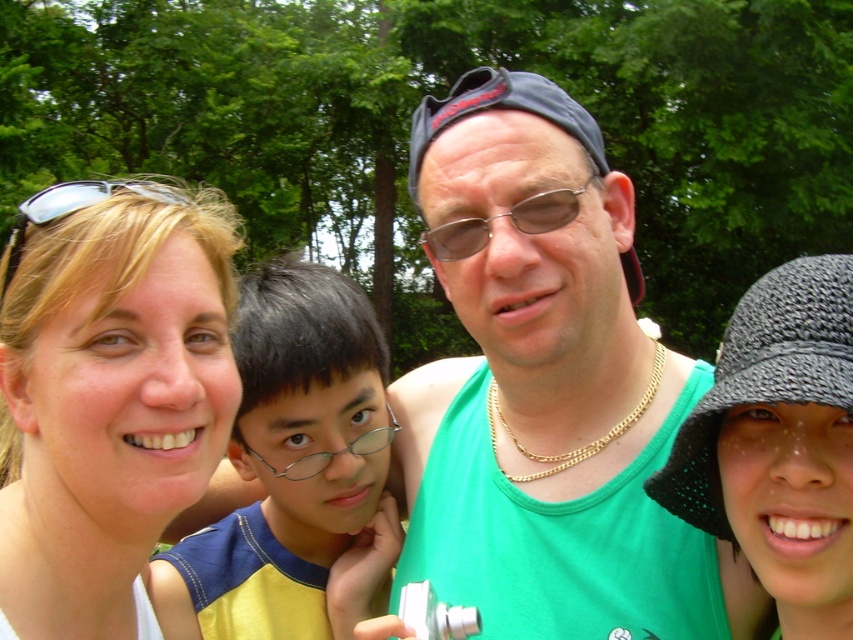
You are trying to decide which item to grab first from the scene. Based on their sizes, which one is wider between the green fabric tank top at center and the blonde hair at upper left?

The green fabric tank top at center is wider than the blonde hair at upper left according to the description.

You are a photographer trying to capture the blonde hair at upper left and the yellow fabric shirt at center in a single frame. Can you ensure both are visible in the shot without moving any subjects?

The blonde hair at upper left is positioned over the yellow fabric shirt at center, so the photographer can capture both in the frame as they are already overlapping and not obstructed from view.

You are a photographer standing 1 meter away from the green fabric tank top at center and the yellow fabric shirt at center. You want to take a group photo of both items. Can you fit both into your camera frame if your camera has a maximum horizontal field of view of 30 centimeters?

The distance between the green fabric tank top at center and the yellow fabric shirt at center is 25.26 centimeters. Since the camera has a maximum horizontal field of view of 30 centimeters, which is wider than the distance between them, both items can fit within the frame.